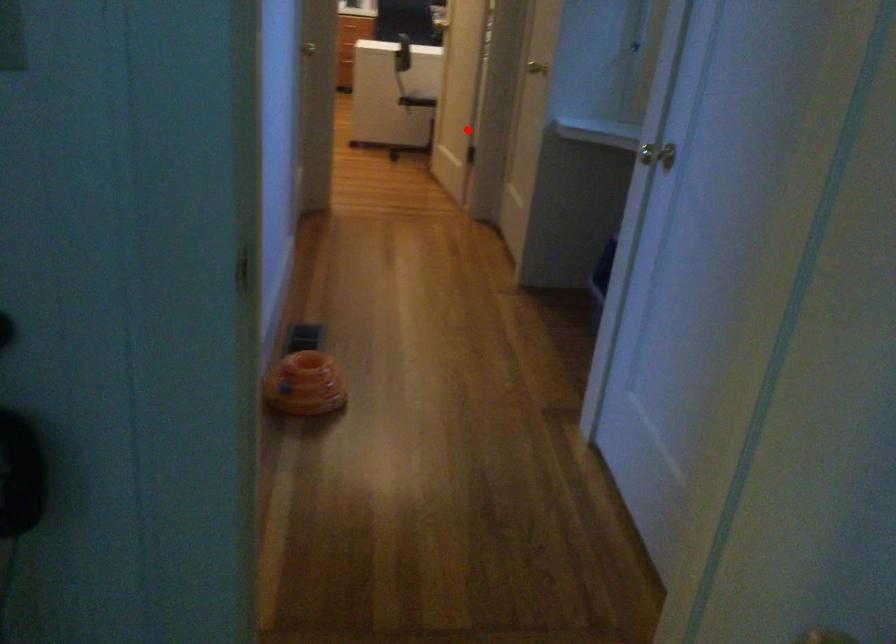
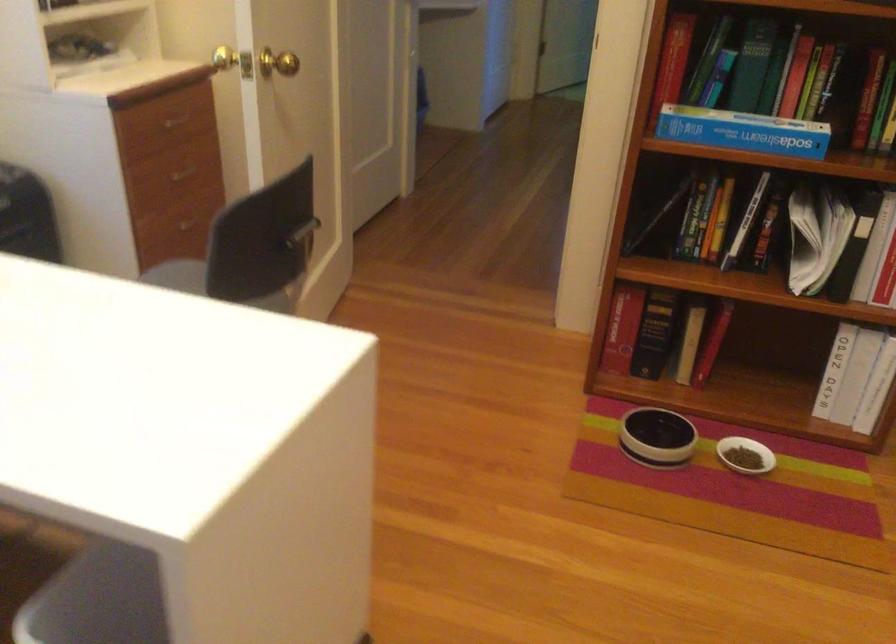
Question: I am providing you with two images of the same scene from different viewpoints. A red point is shown in image1. For the corresponding object point in image2, is it positioned nearer or farther from the camera?

Choices:
 (A) Nearer
 (B) Farther

Answer: (A)